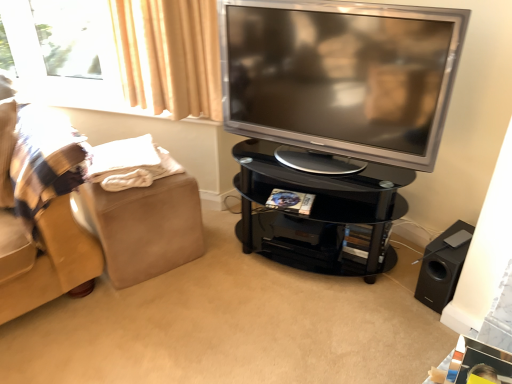
Find the location of a particular element. Image resolution: width=512 pixels, height=384 pixels. vacant point above black matte speaker at lower right (from a real-world perspective) is located at coordinates (452, 236).